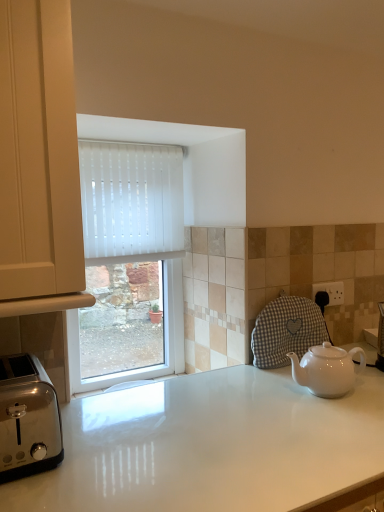
Identify the location of empty space that is ontop of white glossy countertop at center. (238, 421).